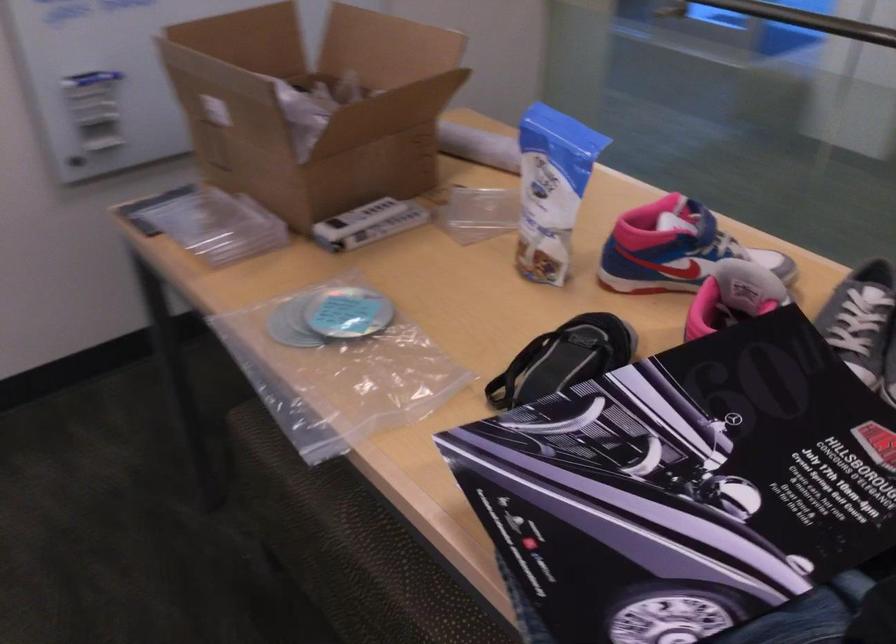
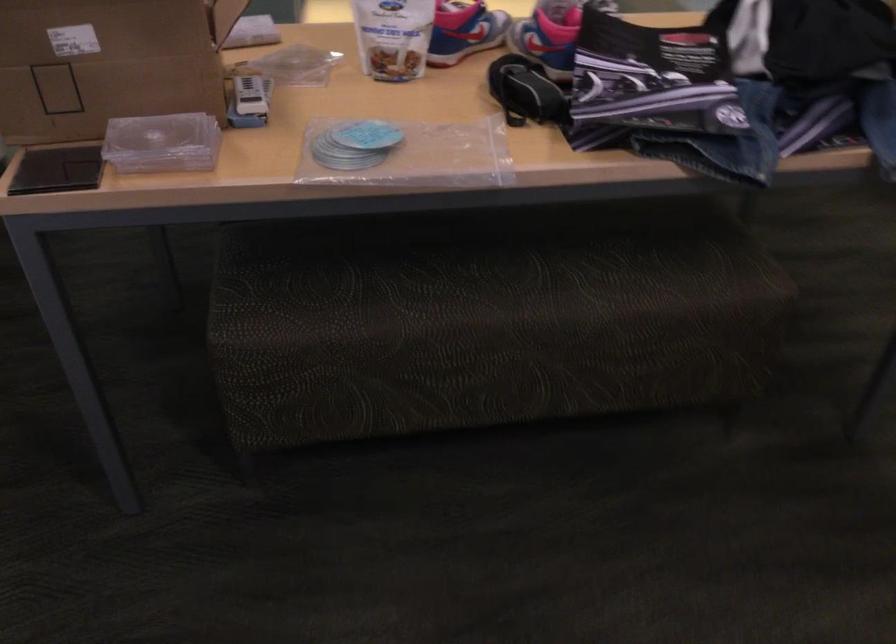
Locate, in the second image, the point that corresponds to point (707, 325) in the first image.

(549, 37)